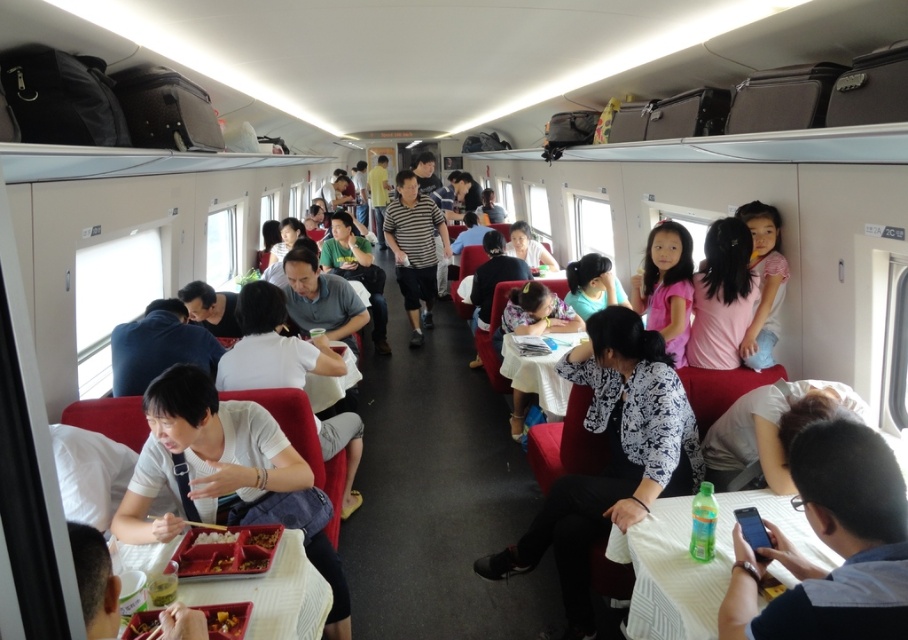
You are a passenger sitting in the train carriage and want to determine which clothing item is bigger between the white printed blouse at center and the matte gray shirt at center. Which one is larger?

The white printed blouse at center is larger than the matte gray shirt at center.

You are sitting in the train carriage and want to know where the matte gray shirt at center is located. Can you describe its position using the coordinate system provided?

The matte gray shirt at center is located at the coordinate point 0.853 on the x axis and 0.916 on the y axis.

You are a passenger sitting in the train carriage and want to know what is at the center of the image. According to the coordinates provided, what object is located at point (x=666, y=285)?

The point (x=666, y=285) corresponds to the pink satin dress at center, so the object at that coordinate is the pink satin dress at center.